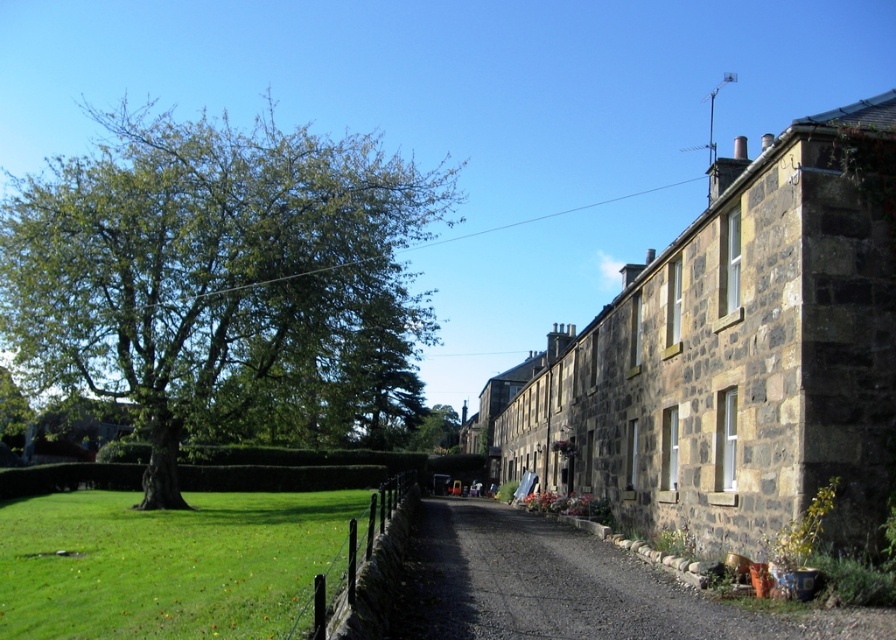
Does green grass at lower left appear on the left side of gray gravel driveway at center?

Yes, green grass at lower left is to the left of gray gravel driveway at center.

Is green grass at lower left taller than gray gravel driveway at center?

Yes.

Between point (159, 577) and point (445, 568), which one is positioned in front?

Point (159, 577) is in front.

This screenshot has height=640, width=896. I want to click on green grass at lower left, so click(166, 563).

Is green leafy tree at left positioned behind green grass at lower left?

Yes, it is.

This screenshot has width=896, height=640. What do you see at coordinates (222, 280) in the screenshot?
I see `green leafy tree at left` at bounding box center [222, 280].

Where is `green leafy tree at left`? The image size is (896, 640). green leafy tree at left is located at coordinates (222, 280).

Image resolution: width=896 pixels, height=640 pixels. What are the coordinates of `green leafy tree at left` in the screenshot? It's located at (222, 280).

Which of these two, green leafy tree at left or gray gravel driveway at center, stands taller?

With more height is green leafy tree at left.

At what (x,y) coordinates should I click in order to perform the action: click on green leafy tree at left. Please return your answer as a coordinate pair (x, y). This screenshot has height=640, width=896. Looking at the image, I should click on (222, 280).

Is point (240, 208) more distant than point (458, 538)?

Yes, it is.

Where is `green leafy tree at left`? The height and width of the screenshot is (640, 896). green leafy tree at left is located at coordinates (222, 280).